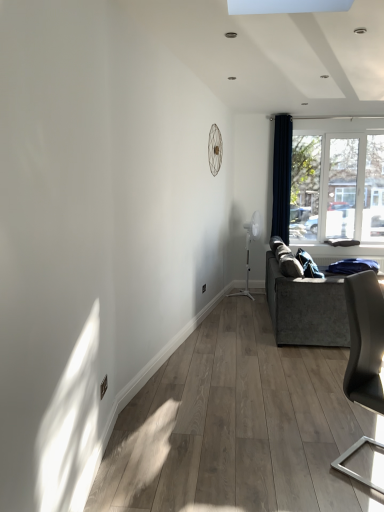
Find the location of a particular element. This screenshot has width=384, height=512. vacant space situated on the left part of matte gray chair at right is located at coordinates (303, 458).